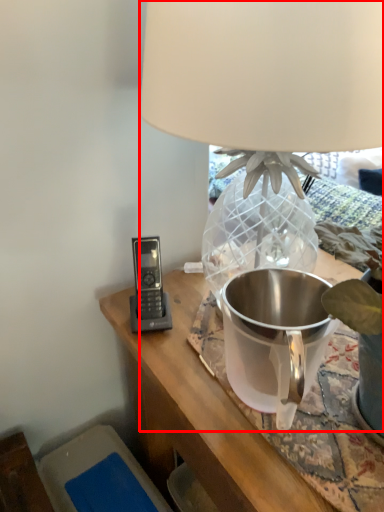
Question: From the image's perspective, where is lamp (annotated by the red box) located relative to appliance?

Choices:
 (A) below
 (B) above

Answer: (B)